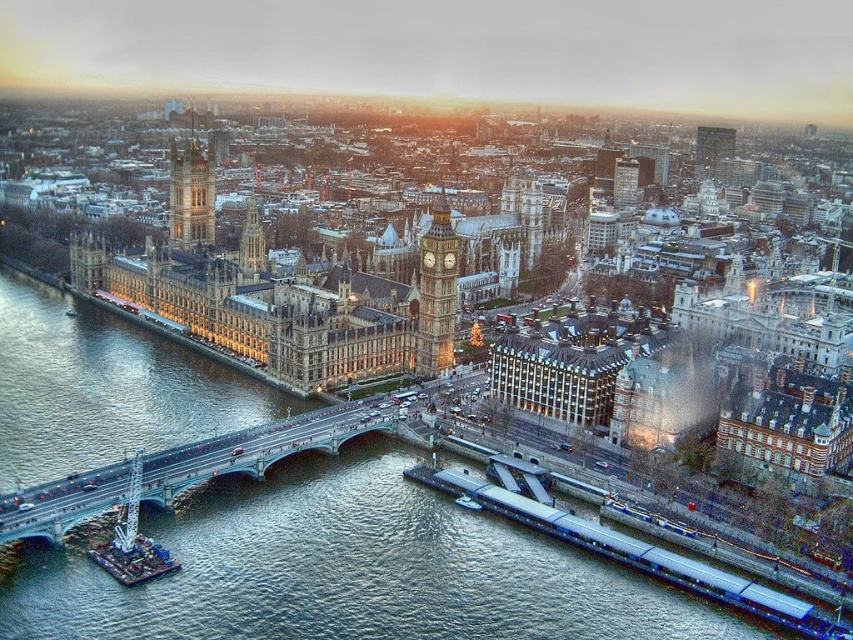
Question: Is the position of green metallic bridge at lower left more distant than that of golden stone clock tower at center?

Choices:
 (A) no
 (B) yes

Answer: (A)

Question: Can you confirm if green metallic bridge at lower left is thinner than golden stone clock tower at upper left?

Choices:
 (A) yes
 (B) no

Answer: (A)

Question: Which of these objects is positioned farthest from the golden stone clock tower at upper left?

Choices:
 (A) golden stone clock tower at center
 (B) green metallic bridge at lower left

Answer: (B)

Question: Which point is farther to the camera?

Choices:
 (A) (181, 225)
 (B) (427, 339)

Answer: (A)

Question: Which point appears closest to the camera in this image?

Choices:
 (A) (22, 492)
 (B) (212, 234)

Answer: (A)

Question: Considering the relative positions of green metallic bridge at lower left and golden stone clock tower at upper left in the image provided, where is green metallic bridge at lower left located with respect to golden stone clock tower at upper left?

Choices:
 (A) below
 (B) above

Answer: (A)